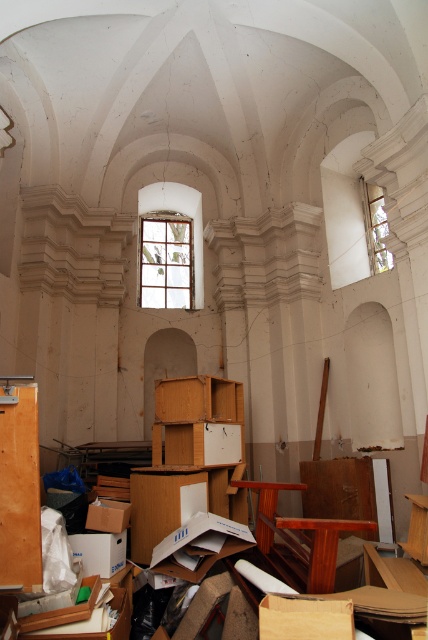
Is clear glass window at center positioned behind clear glass window at upper right?

Yes.

Does clear glass window at center have a lesser width compared to clear glass window at upper right?

Incorrect, clear glass window at center's width is not less than clear glass window at upper right's.

The image size is (428, 640). Describe the element at coordinates (166, 260) in the screenshot. I see `clear glass window at center` at that location.

Find the location of `clear glass window at center`. clear glass window at center is located at coordinates (166, 260).